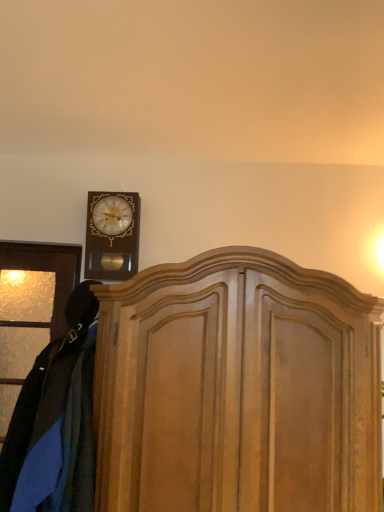
Question: Is wooden dresser at center wider than velvet blue coat at left?

Choices:
 (A) yes
 (B) no

Answer: (A)

Question: Does wooden dresser at center come behind velvet blue coat at left?

Choices:
 (A) yes
 (B) no

Answer: (A)

Question: Is wooden dresser at center next to velvet blue coat at left and touching it?

Choices:
 (A) no
 (B) yes

Answer: (A)

Question: Is wooden dresser at center at the right side of velvet blue coat at left?

Choices:
 (A) no
 (B) yes

Answer: (B)

Question: Is velvet blue coat at left located within wooden dresser at center?

Choices:
 (A) no
 (B) yes

Answer: (A)

Question: Would you say velvet blue coat at left is to the left or to the right of wooden wall clock at upper left in the picture?

Choices:
 (A) left
 (B) right

Answer: (A)

Question: Is velvet blue coat at left spatially inside wooden wall clock at upper left, or outside of it?

Choices:
 (A) outside
 (B) inside

Answer: (A)

Question: Considering their positions, is velvet blue coat at left located in front of or behind wooden wall clock at upper left?

Choices:
 (A) front
 (B) behind

Answer: (A)

Question: Considering the positions of velvet blue coat at left and wooden wall clock at upper left in the image, is velvet blue coat at left bigger or smaller than wooden wall clock at upper left?

Choices:
 (A) big
 (B) small

Answer: (A)

Question: From their relative heights in the image, would you say wooden dresser at center is taller or shorter than velvet blue coat at left?

Choices:
 (A) short
 (B) tall

Answer: (B)

Question: Looking at their shapes, would you say wooden dresser at center is wider or thinner than velvet blue coat at left?

Choices:
 (A) wide
 (B) thin

Answer: (A)

Question: Is point tap(193, 258) closer or farther from the camera than point tap(44, 498)?

Choices:
 (A) closer
 (B) farther

Answer: (B)

Question: From the image's perspective, is wooden dresser at center above or below velvet blue coat at left?

Choices:
 (A) above
 (B) below

Answer: (B)

Question: Looking at their shapes, would you say velvet blue coat at left is wider or thinner than wooden dresser at center?

Choices:
 (A) wide
 (B) thin

Answer: (B)

Question: From the image's perspective, relative to wooden dresser at center, is velvet blue coat at left above or below?

Choices:
 (A) below
 (B) above

Answer: (B)